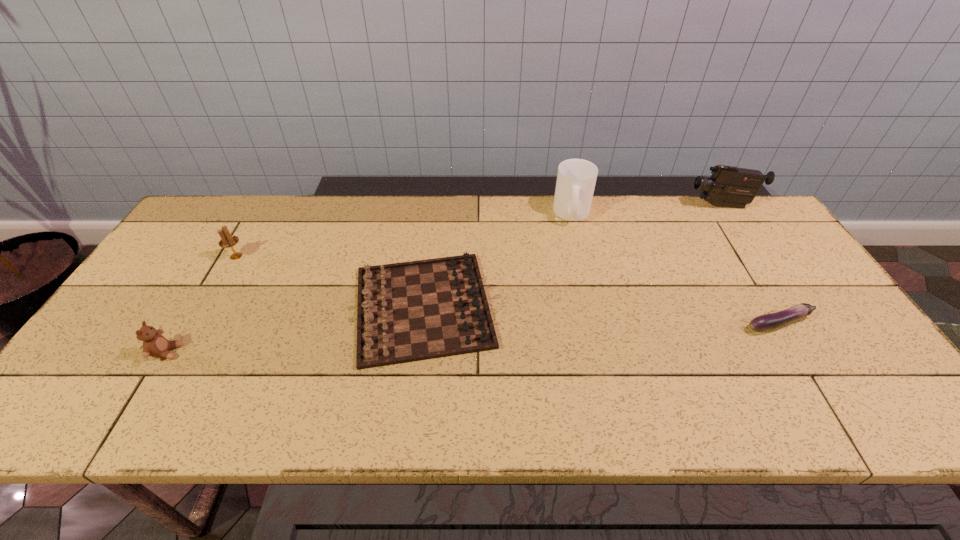
This screenshot has width=960, height=540. In order to click on free space that is in between the third object from right to left and the fourth object from right to left in this screenshot , I will do `click(497, 260)`.

Select which object appears as the second closest to the fourth tallest object. Please provide its 2D coordinates. Your answer should be formatted as a tuple, i.e. [(x, y)], where the tuple contains the x and y coordinates of a point satisfying the conditions above.

[(410, 311)]

Identify which object is the closest to the mug. Please provide its 2D coordinates. Your answer should be formatted as a tuple, i.e. [(x, y)], where the tuple contains the x and y coordinates of a point satisfying the conditions above.

[(410, 311)]

Image resolution: width=960 pixels, height=540 pixels. I want to click on free location that satisfies the following two spatial constraints: 1. on the front-facing side of the camcorder; 2. on the handle side of the mug, so click(x=727, y=213).

Identify the location of free space that satisfies the following two spatial constraints: 1. on the front-facing side of the camcorder; 2. on the front side of the fourth object from right to left. Image resolution: width=960 pixels, height=540 pixels. (787, 307).

Identify the location of vacant region that satisfies the following two spatial constraints: 1. on the front-facing side of the camcorder; 2. on the handle side of the mug. The width and height of the screenshot is (960, 540). (727, 213).